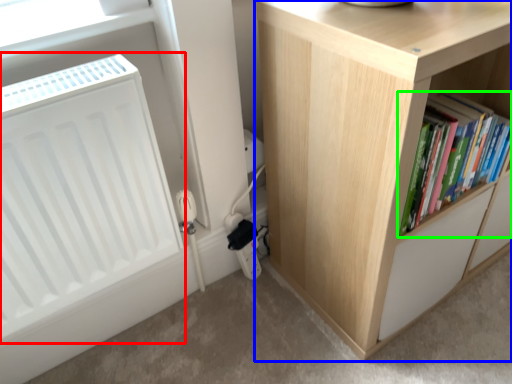
Question: Based on their relative distances, which object is farther from radiator (highlighted by a red box)? Choose from cupboard (highlighted by a blue box) and book (highlighted by a green box).

Choices:
 (A) cupboard
 (B) book

Answer: (B)